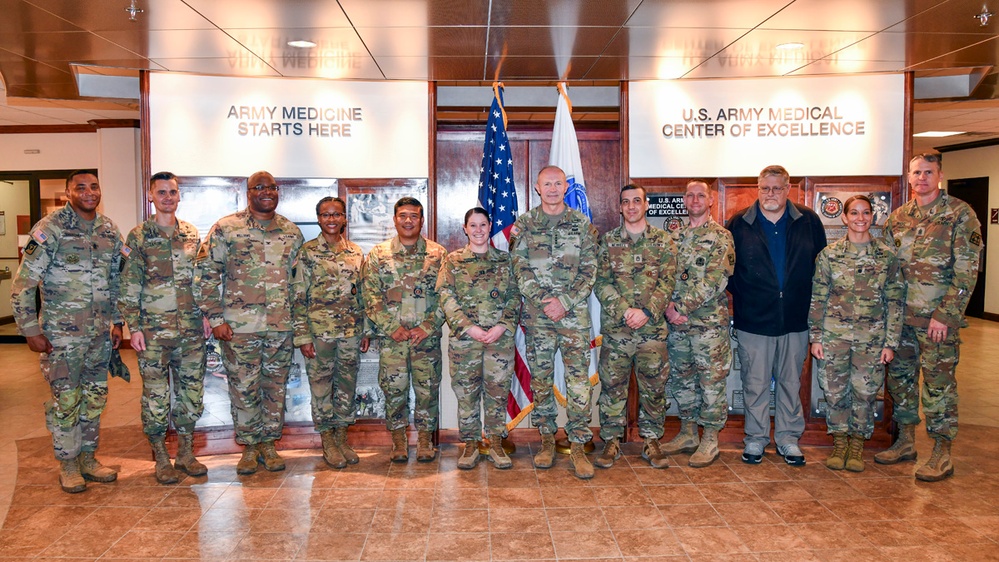
Image resolution: width=999 pixels, height=562 pixels. Identify the location of ceiling. (505, 22).